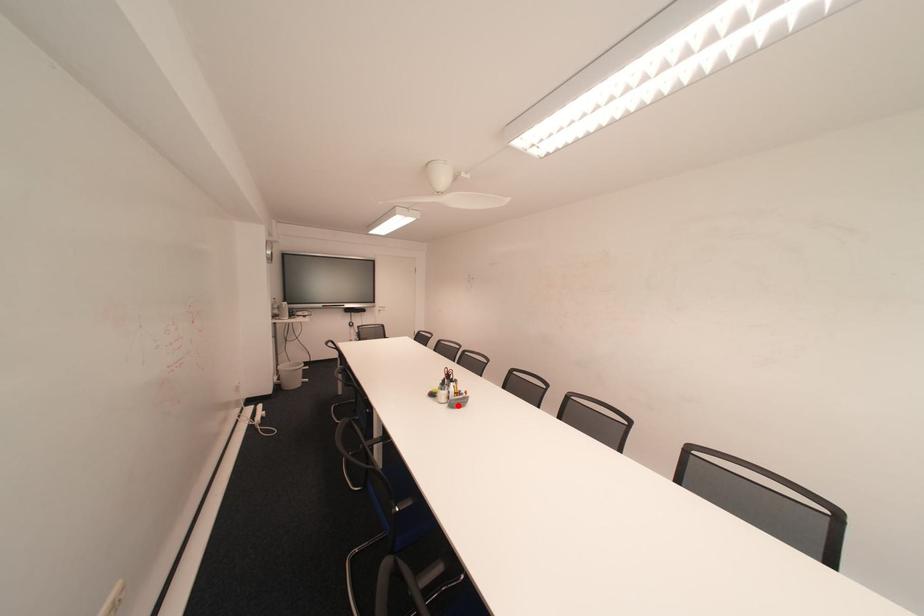
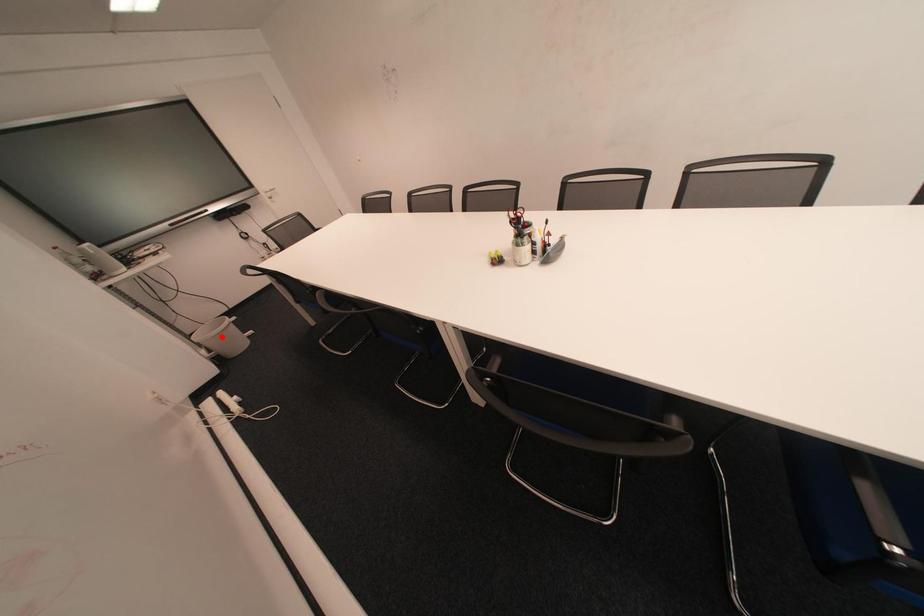
I am providing you with two images of the same scene from different viewpoints. A red point is marked on the first image and another point is marked on the second image. Does the point marked in image1 correspond to the same location as the one in image2?

No